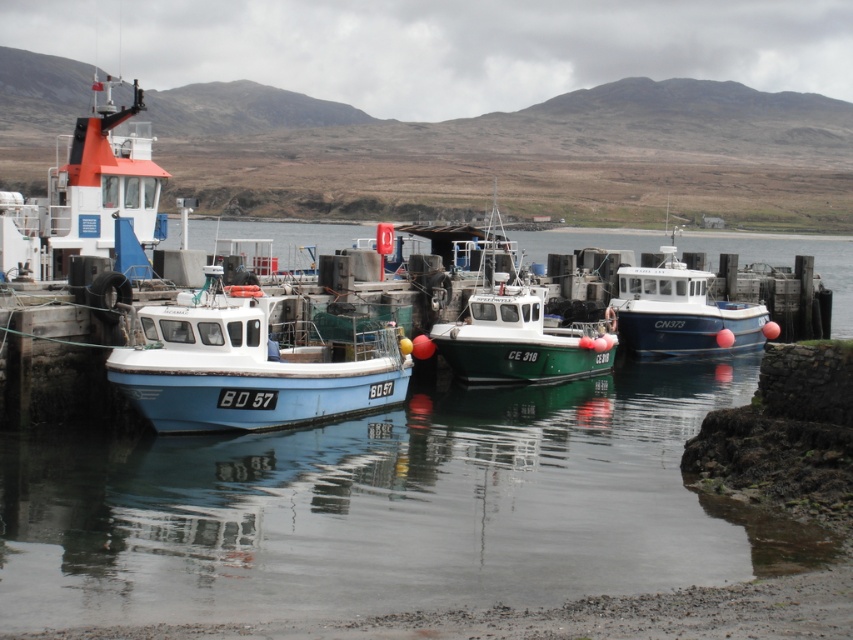
In the scene shown: You are a harbor inspector and need to locate the green matte boat at center. What are its coordinates?

The green matte boat at center is located at coordinates (515, 326).

You are a dock worker who needs to load a 3m wide cargo container onto one of the boats. The light blue matte boat at center and the green matte boat at center are both available. Which boat can accommodate the cargo container based on their widths?

The green matte boat at center has a greater width than the light blue matte boat at center, so the green matte boat at center can accommodate the 3m wide cargo container.

You are a marine biologist preparing to board a boat for a research trip. You see the light blue matte boat at center and the green matte boat at center. Which boat is positioned lower in the image?

The light blue matte boat at center is positioned lower than the green matte boat at center in the image.